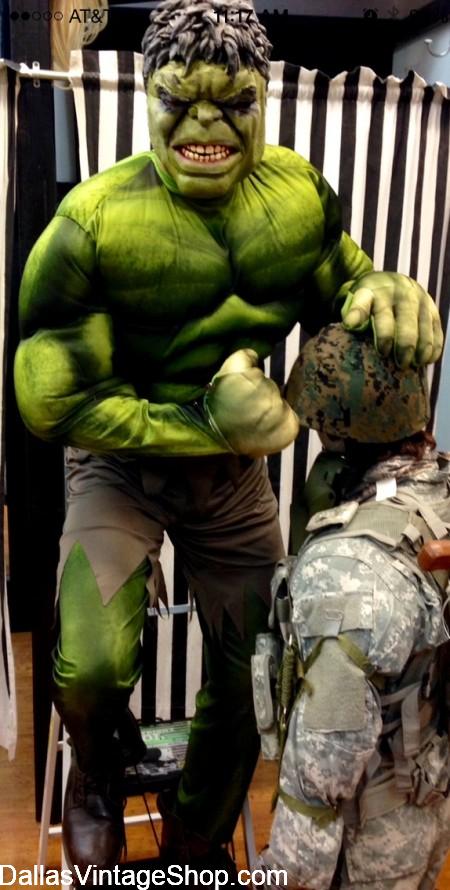
You are a GUI agent. You are given a task and a screenshot of the screen. Output one action in this format:
    pyautogui.click(x=<x>, y=<y>)
    Task: Click on the step ladder
    Image resolution: width=450 pixels, height=890 pixels.
    Given the screenshot: What is the action you would take?
    pos(163,740)